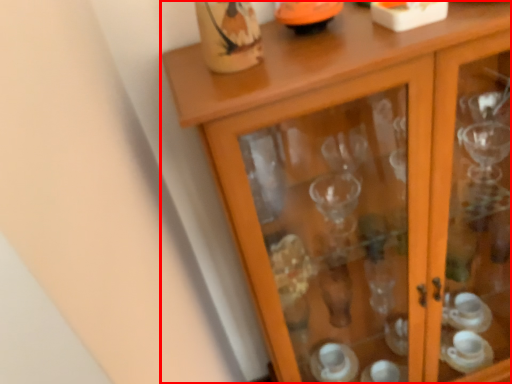
Question: From the image's perspective, what is the correct spatial positioning of cupboard (annotated by the red box) in reference to tableware?

Choices:
 (A) above
 (B) below

Answer: (B)